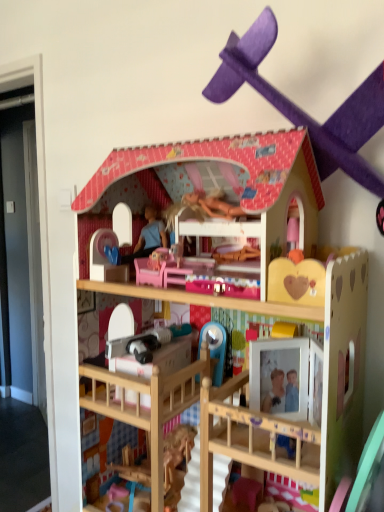
Question: Considering the relative positions of wooden dollhouse at center, which is the 2th toy from top to bottom, and purple cardboard airplane at upper center, the 2th toy from the bottom, in the image provided, is wooden dollhouse at center, which is the 2th toy from top to bottom, to the left or to the right of purple cardboard airplane at upper center, the 2th toy from the bottom,?

Choices:
 (A) right
 (B) left

Answer: (B)

Question: Looking at the image, does wooden dollhouse at center, which is the 2th toy from top to bottom, seem bigger or smaller compared to purple cardboard airplane at upper center, the 2th toy from the bottom?

Choices:
 (A) big
 (B) small

Answer: (A)

Question: Considering the positions of wooden dollhouse at center, which is the 2th toy from top to bottom, and purple cardboard airplane at upper center, the 2th toy from the bottom, in the image, is wooden dollhouse at center, which is the 2th toy from top to bottom, taller or shorter than purple cardboard airplane at upper center, the 2th toy from the bottom,?

Choices:
 (A) tall
 (B) short

Answer: (A)

Question: Relative to wooden dollhouse at center, which is the 2th toy from top to bottom, is purple cardboard airplane at upper center, the 2th toy from the bottom, in front or behind?

Choices:
 (A) front
 (B) behind

Answer: (A)

Question: Looking at their shapes, would you say purple cardboard airplane at upper center, the 2th toy from the bottom, is wider or thinner than wooden dollhouse at center, which is the 2th toy from top to bottom?

Choices:
 (A) wide
 (B) thin

Answer: (B)

Question: From a real-world perspective, is purple cardboard airplane at upper center, the 2th toy from the bottom, physically located above or below wooden dollhouse at center, which is the 2th toy from top to bottom?

Choices:
 (A) below
 (B) above

Answer: (B)

Question: Would you say purple cardboard airplane at upper center, the 2th toy from the bottom, is inside or outside wooden dollhouse at center, which is the 2th toy from top to bottom?

Choices:
 (A) outside
 (B) inside

Answer: (A)